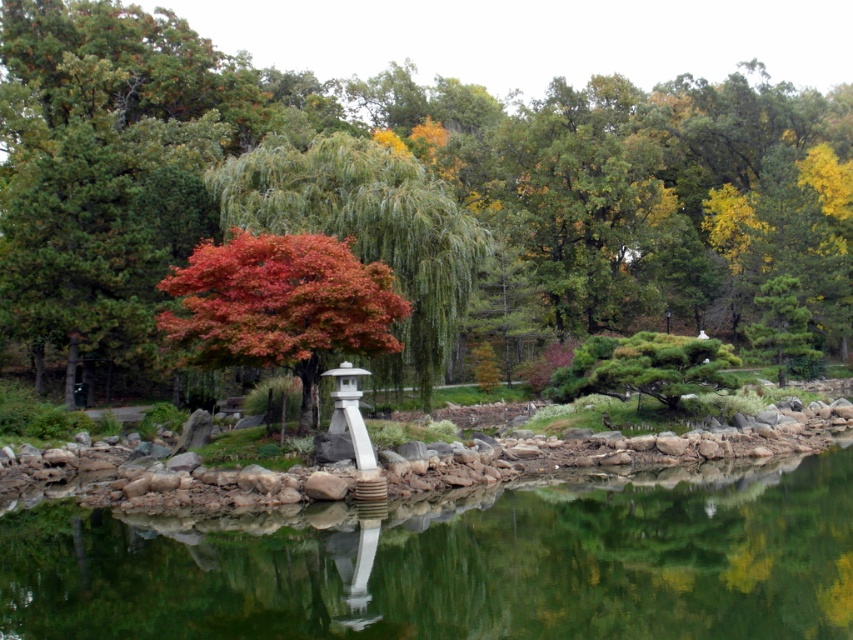
In the scene shown: Does green smooth water at center have a greater width compared to reddish-brown bark tree at center?

Yes.

Is green smooth water at center below reddish-brown bark tree at center?

Yes.

The image size is (853, 640). Identify the location of green smooth water at center. (457, 563).

Does reddish-brown wood tree at center come in front of green smooth water at center?

No, it is not.

Describe the element at coordinates (403, 192) in the screenshot. This screenshot has height=640, width=853. I see `reddish-brown wood tree at center` at that location.

Where is `reddish-brown wood tree at center`? The height and width of the screenshot is (640, 853). reddish-brown wood tree at center is located at coordinates (403, 192).

Identify the location of reddish-brown wood tree at center. (403, 192).

Which is below, reddish-brown bark tree at center or shiny red maple tree at center?

shiny red maple tree at center is lower down.

Is reddish-brown bark tree at center to the right of shiny red maple tree at center from the viewer's perspective?

Correct, you'll find reddish-brown bark tree at center to the right of shiny red maple tree at center.

Is point (294, 200) positioned behind point (331, 316)?

Yes, point (294, 200) is behind point (331, 316).

Locate an element on the screen. The width and height of the screenshot is (853, 640). reddish-brown bark tree at center is located at coordinates (366, 228).